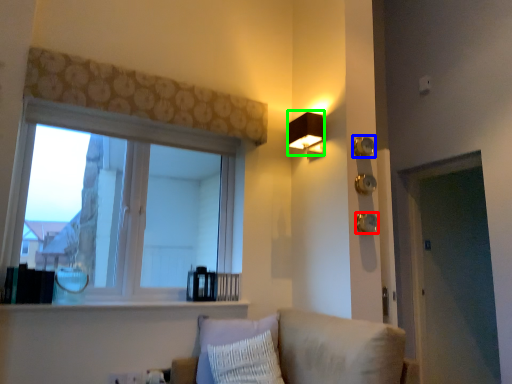
Question: Which object is the farthest from knob (highlighted by a red box)? Choose among these: knob (highlighted by a blue box) or lamp (highlighted by a green box).

Choices:
 (A) knob
 (B) lamp

Answer: (B)